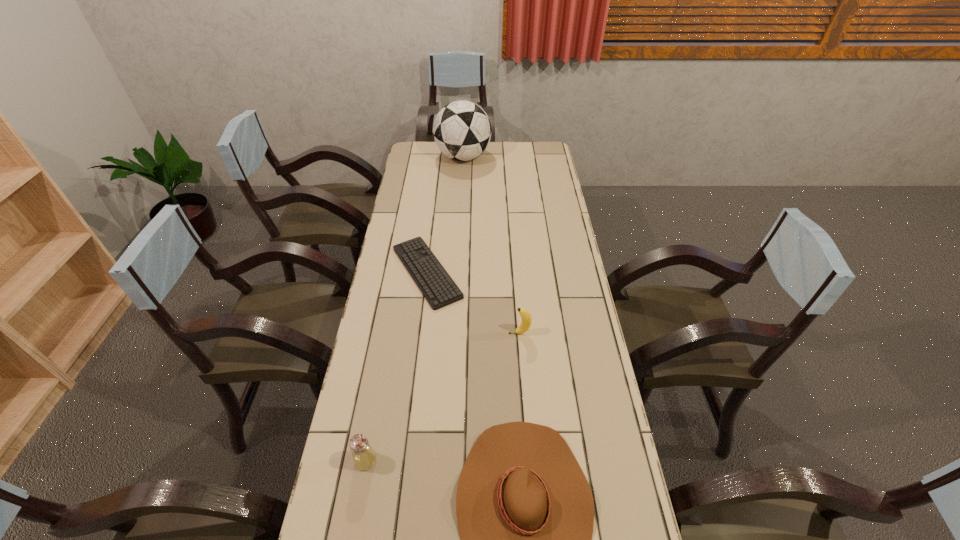
What are the coordinates of `blank space at the far left corner of the desktop` in the screenshot? It's located at (426, 161).

The height and width of the screenshot is (540, 960). In order to click on vacant point located between the farthest object and the computer keyboard in this screenshot , I will do `click(444, 215)`.

The height and width of the screenshot is (540, 960). What are the coordinates of `free space between the third farthest object and the soccer ball` in the screenshot? It's located at (492, 245).

Image resolution: width=960 pixels, height=540 pixels. I want to click on free space between the third nearest object and the fourth nearest object, so click(473, 303).

Identify the location of free space between the third nearest object and the saltshaker. Image resolution: width=960 pixels, height=540 pixels. coord(443,397).

You are a GUI agent. You are given a task and a screenshot of the screen. Output one action in this format:
    pyautogui.click(x=<x>, y=<y>)
    Task: Click on the free space that is in between the soccer ball and the banana
    This screenshot has height=540, width=960.
    Given the screenshot: What is the action you would take?
    pyautogui.click(x=492, y=245)

Locate an element on the screen. free space between the computer keyboard and the saltshaker is located at coordinates (396, 366).

Find the location of a particular element. Image resolution: width=960 pixels, height=540 pixels. free spot between the computer keyboard and the farthest object is located at coordinates (444, 215).

Identify the location of object that ranks as the third closest to the farthest object. (525, 511).

Where is `the fourth closest object relative to the farthest object`? the fourth closest object relative to the farthest object is located at coordinates (364, 457).